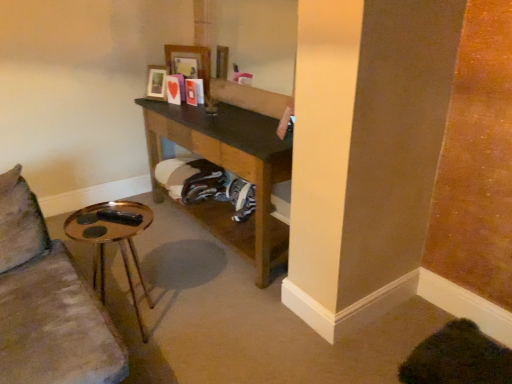
Describe the element at coordinates (229, 170) in the screenshot. I see `brown wooden shelf at center` at that location.

Find the location of a particular element. Image resolution: width=512 pixels, height=384 pixels. gold metallic side table at lower left is located at coordinates (112, 239).

Identify the location of wooden photo frame at upper center, the 1th picture frame in the left-to-right sequence. (156, 82).

Locate an element on the screen. The height and width of the screenshot is (384, 512). brown wooden shelf at center is located at coordinates tap(229, 170).

Who is more distant, gold metallic side table at lower left or brown wooden shelf at center?

brown wooden shelf at center.

How much distance is there between gold metallic side table at lower left and brown wooden shelf at center?

The distance of gold metallic side table at lower left from brown wooden shelf at center is 25.96 inches.

Does gold metallic side table at lower left have a smaller size compared to brown wooden shelf at center?

Indeed, gold metallic side table at lower left has a smaller size compared to brown wooden shelf at center.

Is gold metallic side table at lower left positioned far away from brown wooden shelf at center?

No, there isn't a large distance between gold metallic side table at lower left and brown wooden shelf at center.

Which is closer to the camera, (x=77, y=215) or (x=169, y=55)?

Clearly, point (x=77, y=215) is closer to the camera than point (x=169, y=55).

Is gold metallic side table at lower left smaller than wooden picture frame at upper center, placed as the first picture frame when sorted from right to left?

Actually, gold metallic side table at lower left might be larger than wooden picture frame at upper center, placed as the first picture frame when sorted from right to left.

Who is more distant, gold metallic side table at lower left or wooden picture frame at upper center, placed as the first picture frame when sorted from right to left?

wooden picture frame at upper center, placed as the first picture frame when sorted from right to left, is behind.

Can we say gold metallic side table at lower left lies outside wooden picture frame at upper center, placed as the first picture frame when sorted from right to left?

Yes.

Consider the image. Relative to brown wooden shelf at center, is wooden photo frame at upper center, the 2th picture frame from the right, in front or behind?

wooden photo frame at upper center, the 2th picture frame from the right, is behind brown wooden shelf at center.

From a real-world perspective, which object stands above the other?

wooden photo frame at upper center, the 2th picture frame from the right.

Could you tell me if wooden photo frame at upper center, the 1th picture frame in the left-to-right sequence, is facing brown wooden shelf at center?

No, wooden photo frame at upper center, the 1th picture frame in the left-to-right sequence, is not turned towards brown wooden shelf at center.

Between wooden picture frame at upper center, acting as the second picture frame starting from the left, and brown wooden shelf at center, which one has larger size?

brown wooden shelf at center is bigger.

Is wooden picture frame at upper center, acting as the second picture frame starting from the left, in front of or behind brown wooden shelf at center in the image?

In the image, wooden picture frame at upper center, acting as the second picture frame starting from the left, appears behind brown wooden shelf at center.

Is wooden picture frame at upper center, acting as the second picture frame starting from the left, wider or thinner than brown wooden shelf at center?

wooden picture frame at upper center, acting as the second picture frame starting from the left, is thinner than brown wooden shelf at center.

Is point (177, 70) farther from camera compared to point (233, 235)?

Yes, it is behind point (233, 235).

From the picture: Which is closer to the camera, (199, 46) or (91, 212)?

The point (91, 212) is more forward.

What's the angular difference between wooden picture frame at upper center, acting as the second picture frame starting from the left, and gold metallic side table at lower left's facing directions?

There is a 66.3-degree angle between the facing directions of wooden picture frame at upper center, acting as the second picture frame starting from the left, and gold metallic side table at lower left.

Would you say wooden picture frame at upper center, placed as the first picture frame when sorted from right to left, contains gold metallic side table at lower left?

No.

In terms of height, does wooden picture frame at upper center, acting as the second picture frame starting from the left, look taller or shorter compared to gold metallic side table at lower left?

Considering their sizes, wooden picture frame at upper center, acting as the second picture frame starting from the left, has less height than gold metallic side table at lower left.

Which of these two, brown wooden shelf at center or wooden photo frame at upper center, the 2th picture frame from the right, is bigger?

brown wooden shelf at center.

Based on the photo, can you confirm if brown wooden shelf at center is wider than wooden photo frame at upper center, the 1th picture frame in the left-to-right sequence?

Indeed, brown wooden shelf at center has a greater width compared to wooden photo frame at upper center, the 1th picture frame in the left-to-right sequence.

Is brown wooden shelf at center completely or partially outside of wooden photo frame at upper center, the 1th picture frame in the left-to-right sequence?

Yes, brown wooden shelf at center is not within wooden photo frame at upper center, the 1th picture frame in the left-to-right sequence.

Considering the relative positions of wooden photo frame at upper center, the 2th picture frame from the right, and wooden picture frame at upper center, placed as the first picture frame when sorted from right to left, in the image provided, is wooden photo frame at upper center, the 2th picture frame from the right, to the left of wooden picture frame at upper center, placed as the first picture frame when sorted from right to left, from the viewer's perspective?

Indeed, wooden photo frame at upper center, the 2th picture frame from the right, is positioned on the left side of wooden picture frame at upper center, placed as the first picture frame when sorted from right to left.

Which is closer, (161,88) or (186,48)?

The point (161,88) is closer to the camera.

How many degrees apart are the facing directions of wooden photo frame at upper center, the 1th picture frame in the left-to-right sequence, and wooden picture frame at upper center, acting as the second picture frame starting from the left?

They differ by 1.9 degrees in their facing directions.

Considering the sizes of objects wooden photo frame at upper center, the 2th picture frame from the right, and wooden picture frame at upper center, placed as the first picture frame when sorted from right to left, in the image provided, who is bigger, wooden photo frame at upper center, the 2th picture frame from the right, or wooden picture frame at upper center, placed as the first picture frame when sorted from right to left,?

wooden picture frame at upper center, placed as the first picture frame when sorted from right to left, is bigger.

Locate an element on the screen. This screenshot has width=512, height=384. table below the brown wooden shelf at center (from the image's perspective) is located at coordinates (112, 239).

Identify the location of table below the wooden picture frame at upper center, acting as the second picture frame starting from the left (from a real-world perspective). The width and height of the screenshot is (512, 384). (112, 239).

Estimate the real-world distances between objects in this image. Which object is further from wooden photo frame at upper center, the 2th picture frame from the right, gold metallic side table at lower left or brown wooden shelf at center?

gold metallic side table at lower left is further to wooden photo frame at upper center, the 2th picture frame from the right.

Which object lies nearer to the anchor point wooden photo frame at upper center, the 2th picture frame from the right, gold metallic side table at lower left or wooden picture frame at upper center, acting as the second picture frame starting from the left?

Based on the image, wooden picture frame at upper center, acting as the second picture frame starting from the left, appears to be nearer to wooden photo frame at upper center, the 2th picture frame from the right.

When comparing their distances from brown wooden shelf at center, does gold metallic side table at lower left or wooden picture frame at upper center, acting as the second picture frame starting from the left, seem further?

Based on the image, gold metallic side table at lower left appears to be further to brown wooden shelf at center.

Estimate the real-world distances between objects in this image. Which object is closer to wooden picture frame at upper center, placed as the first picture frame when sorted from right to left, gold metallic side table at lower left or wooden photo frame at upper center, the 1th picture frame in the left-to-right sequence?

Based on the image, wooden photo frame at upper center, the 1th picture frame in the left-to-right sequence, appears to be nearer to wooden picture frame at upper center, placed as the first picture frame when sorted from right to left.

Which object lies further to the anchor point brown wooden shelf at center, gold metallic side table at lower left or wooden photo frame at upper center, the 2th picture frame from the right?

wooden photo frame at upper center, the 2th picture frame from the right, is positioned further to the anchor brown wooden shelf at center.

Estimate the real-world distances between objects in this image. Which object is further from gold metallic side table at lower left, wooden picture frame at upper center, placed as the first picture frame when sorted from right to left, or brown wooden shelf at center?

wooden picture frame at upper center, placed as the first picture frame when sorted from right to left, is positioned further to the anchor gold metallic side table at lower left.

Based on their spatial positions, is wooden photo frame at upper center, the 1th picture frame in the left-to-right sequence, or brown wooden shelf at center closer to gold metallic side table at lower left?

Based on the image, brown wooden shelf at center appears to be nearer to gold metallic side table at lower left.

Which object lies further to the anchor point wooden photo frame at upper center, the 1th picture frame in the left-to-right sequence, wooden picture frame at upper center, placed as the first picture frame when sorted from right to left, or gold metallic side table at lower left?

gold metallic side table at lower left.

Where is `picture frame positioned between gold metallic side table at lower left and wooden photo frame at upper center, the 2th picture frame from the right, from near to far`? The width and height of the screenshot is (512, 384). picture frame positioned between gold metallic side table at lower left and wooden photo frame at upper center, the 2th picture frame from the right, from near to far is located at coordinates (190, 63).

At what (x,y) coordinates should I click in order to perform the action: click on picture frame located between brown wooden shelf at center and wooden photo frame at upper center, the 1th picture frame in the left-to-right sequence, in the depth direction. Please return your answer as a coordinate pair (x, y). Looking at the image, I should click on (190, 63).

The width and height of the screenshot is (512, 384). Find the location of `shelf located between gold metallic side table at lower left and wooden picture frame at upper center, acting as the second picture frame starting from the left, in the depth direction`. shelf located between gold metallic side table at lower left and wooden picture frame at upper center, acting as the second picture frame starting from the left, in the depth direction is located at coordinates (229, 170).

This screenshot has width=512, height=384. Identify the location of shelf located between gold metallic side table at lower left and wooden photo frame at upper center, the 1th picture frame in the left-to-right sequence, in the depth direction. (229, 170).